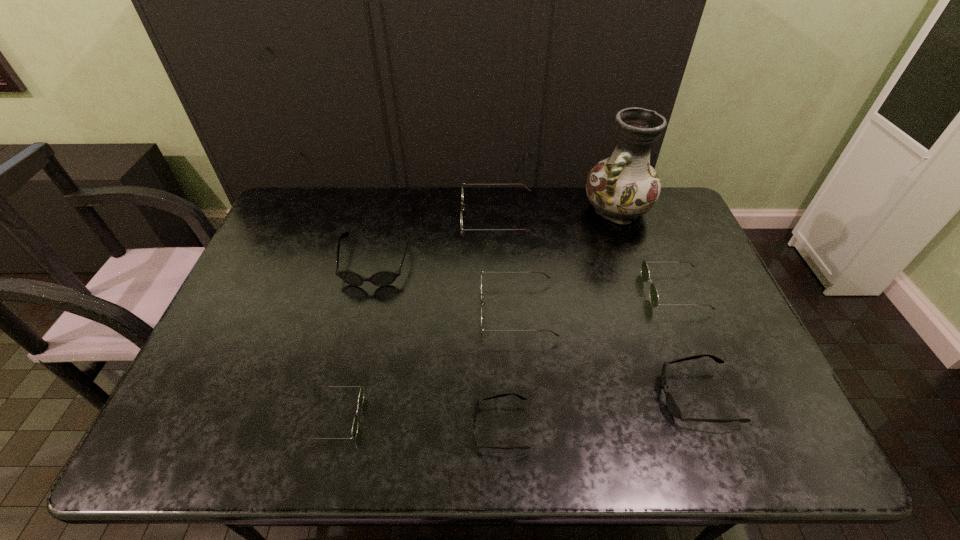
Locate an element on the screen. The height and width of the screenshot is (540, 960). empty space that is in between the farthest green sunglasses and the smallest black sunglasses is located at coordinates (499, 323).

Where is `unoccupied area between the farthest green sunglasses and the rightmost green sunglasses`? unoccupied area between the farthest green sunglasses and the rightmost green sunglasses is located at coordinates (587, 255).

At what (x,y) coordinates should I click in order to perform the action: click on vacant point located between the third smallest green sunglasses and the rightmost green sunglasses. Please return your answer as a coordinate pair (x, y). Image resolution: width=960 pixels, height=540 pixels. Looking at the image, I should click on (596, 301).

Find the location of a particular element. The height and width of the screenshot is (540, 960). blank region between the biggest black sunglasses and the smallest black sunglasses is located at coordinates (438, 346).

Find the location of a particular element. This screenshot has width=960, height=540. free space that is in between the nearest green sunglasses and the second tallest object is located at coordinates (416, 318).

At what (x,y) coordinates should I click in order to perform the action: click on vacant area that lies between the second biggest green sunglasses and the biggest black sunglasses. Please return your answer as a coordinate pair (x, y). The height and width of the screenshot is (540, 960). Looking at the image, I should click on (446, 287).

Identify the location of free space between the third biggest green sunglasses and the red vase. click(x=646, y=251).

I want to click on free area in between the red vase and the nearest green sunglasses, so click(475, 313).

The width and height of the screenshot is (960, 540). I want to click on unoccupied position between the red vase and the farthest black sunglasses, so click(496, 237).

Locate an element on the screen. This screenshot has height=540, width=960. vacant area that lies between the tallest sunglasses and the red vase is located at coordinates (558, 214).